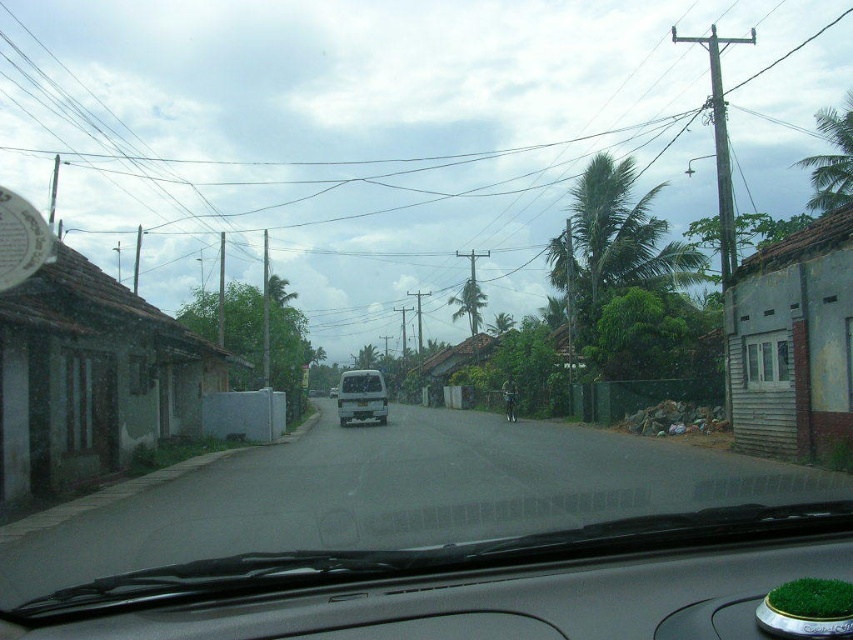
You are driving a car and want to know how far the green leafy palm tree at upper right is from your current position. Can you determine the distance?

The green leafy palm tree at upper right is 31.36 meters away from the viewer, so the distance is 31.36 meters.

You are sitting in a car with a height of 3 feet. You look through the windshield and see a point on the road ahead. The point is represented by the coordinates point (817, 161). Can you determine if the point is within your line of sight?

The point (817, 161) is 128.08 feet away from the camera. Since the car is 3 feet tall, the line of sight would depend on the road elevation. However, based on the distance provided, it is likely within your line of sight unless there are obstacles. The description does not mention any obstructions, so yes, the point (817, 161) is within your line of sight.